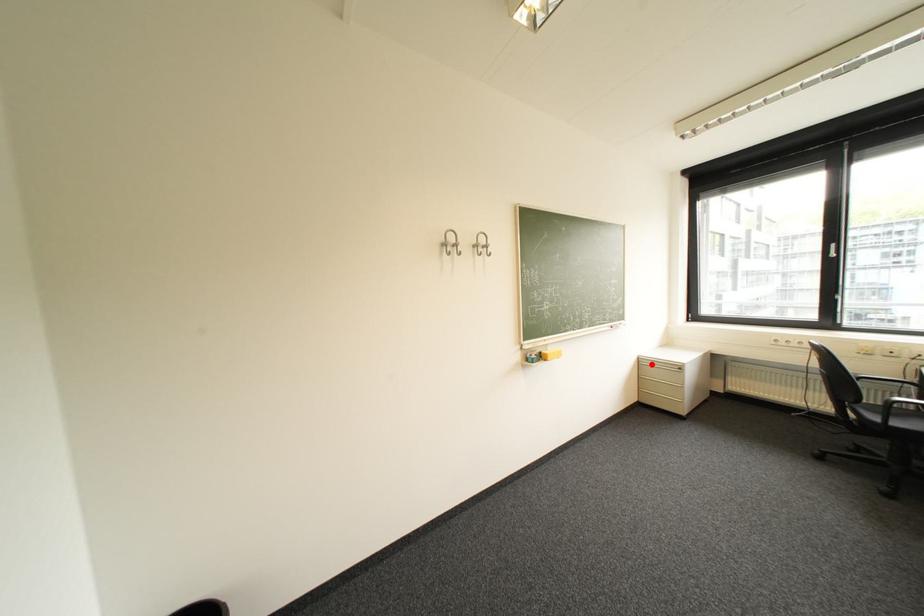
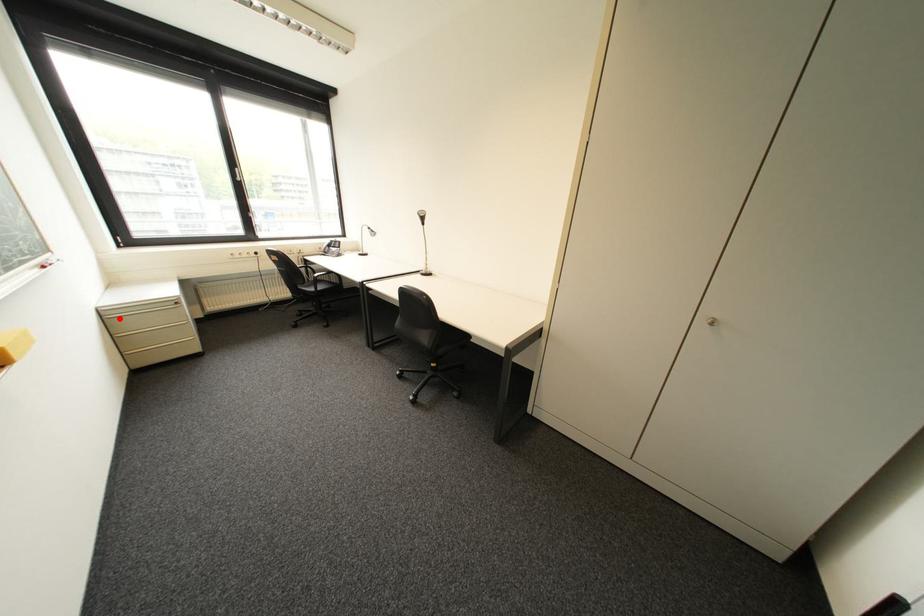
I am providing you with two images of the same scene from different viewpoints. A red point is marked on the first image and another point is marked on the second image. Is the marked point in image1 the same physical position as the marked point in image2?

Yes